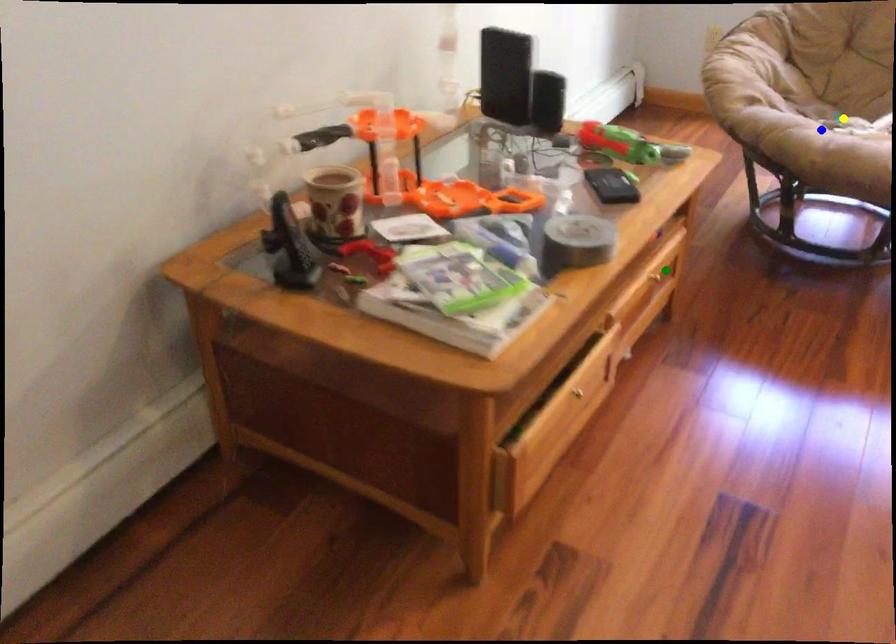
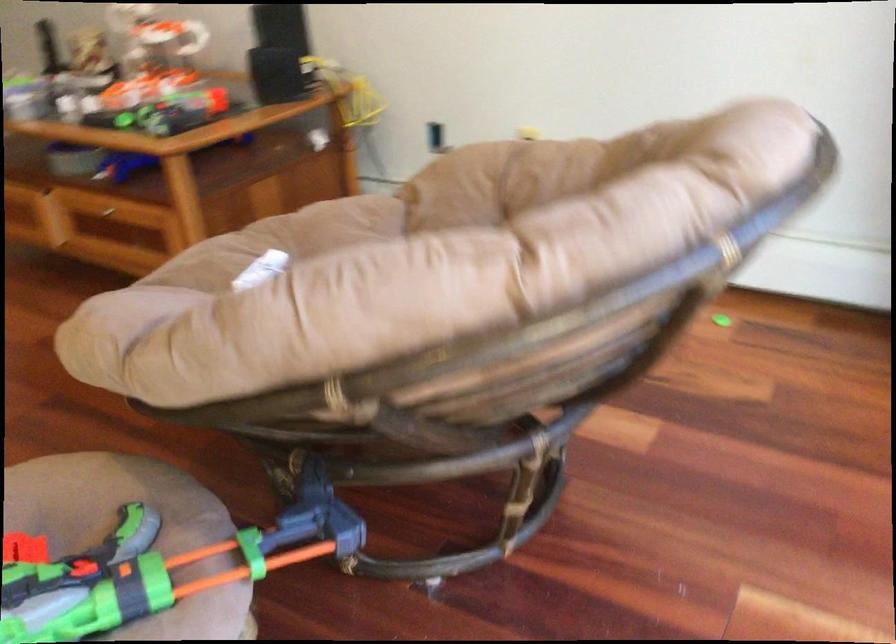
I am providing you with two images of the same scene from different viewpoints. Three points are marked in image1. Which point corresponds to a part or object that is occluded in image2?In image1, three points are marked. Which of them correspond to a part or object that is occluded in image2?Among the three points shown in image1, which one corresponds to a part or object that is no longer visible due to occlusion in image2?

yellow point